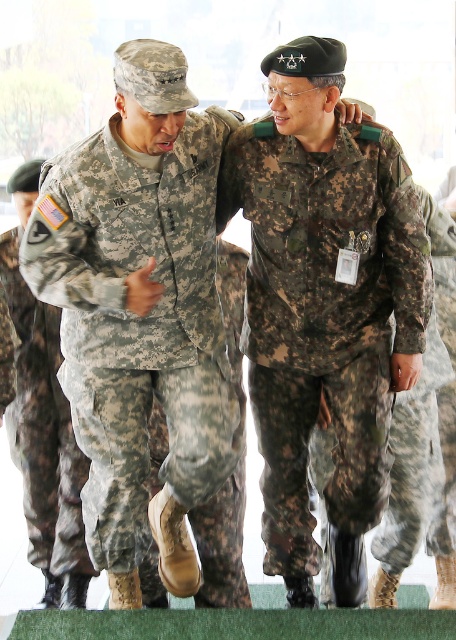
Question: Is camouflage uniform at center thinner than camouflage fabric uniform at center?

Choices:
 (A) no
 (B) yes

Answer: (B)

Question: Estimate the real-world distances between objects in this image. Which object is farther from the camouflage fabric pants at center?

Choices:
 (A) camouflage fabric pants at left
 (B) camouflage fabric uniform at center

Answer: (A)

Question: Is camouflage fabric uniform at center wider than camouflage fabric pants at center?

Choices:
 (A) no
 (B) yes

Answer: (B)

Question: Among these points, which one is farthest from the camera?

Choices:
 (A) click(83, 573)
 (B) click(383, 529)
 (C) click(265, 362)

Answer: (B)

Question: Is camouflage uniform at center to the right of camouflage fabric pants at center from the viewer's perspective?

Choices:
 (A) no
 (B) yes

Answer: (A)

Question: Among these objects, which one is farthest from the camera?

Choices:
 (A) camouflage fabric uniform at center
 (B) camouflage fabric pants at left

Answer: (B)